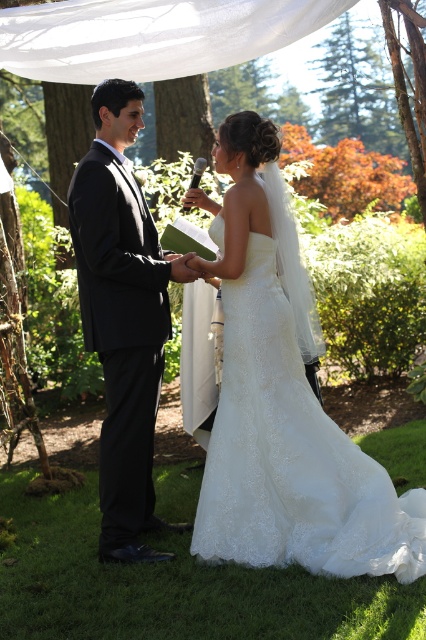
Is point (296, 513) less distant than point (94, 305)?

Yes, point (296, 513) is in front of point (94, 305).

Is the position of white lace wedding dress at center less distant than that of black satin suit at left?

Yes, it is in front of black satin suit at left.

What do you see at coordinates (291, 456) in the screenshot? I see `white lace wedding dress at center` at bounding box center [291, 456].

Where is `white lace wedding dress at center`? white lace wedding dress at center is located at coordinates (291, 456).

Can you confirm if white lace dress at center is wider than white lace wedding dress at center?

Yes.

Is white lace dress at center to the right of white lace wedding dress at center from the viewer's perspective?

Correct, you'll find white lace dress at center to the right of white lace wedding dress at center.

Measure the distance between point [233,371] and camera.

Point [233,371] is 3.90 meters away from camera.

The height and width of the screenshot is (640, 426). What are the coordinates of `white lace dress at center` in the screenshot? It's located at (282, 400).

Is white lace dress at center to the left of black satin suit at left from the viewer's perspective?

In fact, white lace dress at center is to the right of black satin suit at left.

Does white lace dress at center appear on the right side of black satin suit at left?

Correct, you'll find white lace dress at center to the right of black satin suit at left.

Does point (258, 563) lie in front of point (94, 314)?

Yes.

The image size is (426, 640). What are the coordinates of `white lace dress at center` in the screenshot? It's located at (282, 400).